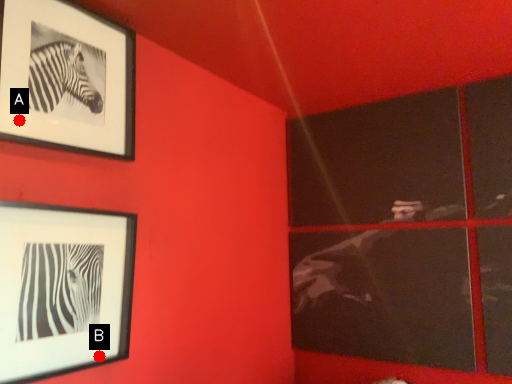
Question: Two points are circled on the image, labeled by A and B beside each circle. Among these points, which one is farthest from the camera?

Choices:
 (A) A is further
 (B) B is further

Answer: (B)